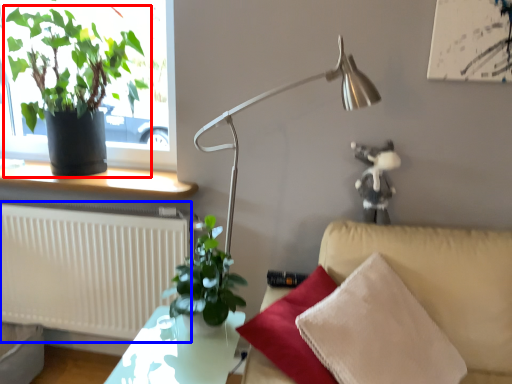
Question: Which point is closer to the camera, houseplant (highlighted by a red box) or radiator (highlighted by a blue box)?

Choices:
 (A) houseplant
 (B) radiator

Answer: (A)